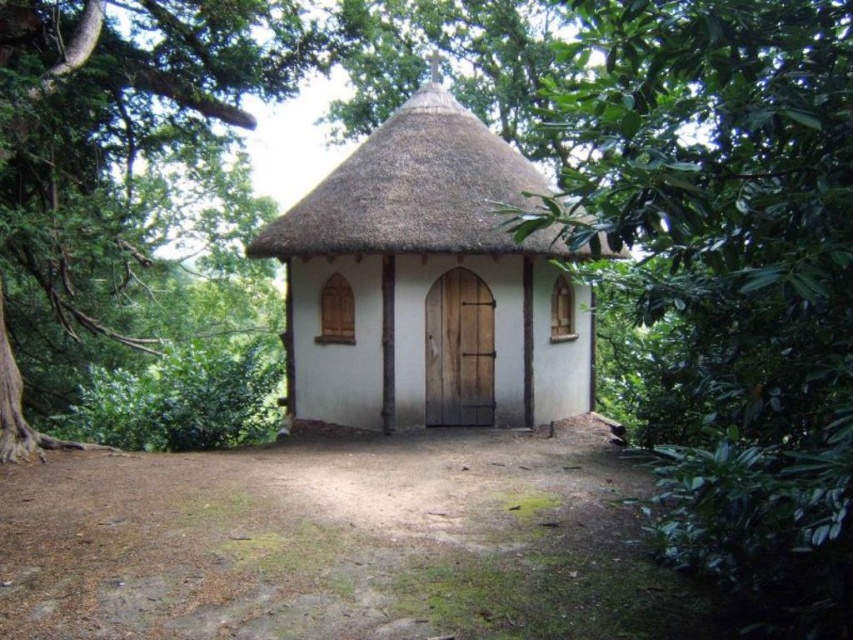
Is green leafy tree at center shorter than white wooden cottage at center?

Indeed, green leafy tree at center has a lesser height compared to white wooden cottage at center.

Does green leafy tree at center have a smaller size compared to white wooden cottage at center?

Yes, green leafy tree at center is smaller than white wooden cottage at center.

Who is more distant from viewer, (704,312) or (448,316)?

Positioned behind is point (448,316).

I want to click on green leafy tree at center, so click(733, 276).

Is white wooden cottage at center to the left of green leafy tree at left from the viewer's perspective?

In fact, white wooden cottage at center is to the right of green leafy tree at left.

Does point (492, 208) come in front of point (86, 198)?

Yes.

The image size is (853, 640). What are the coordinates of `white wooden cottage at center` in the screenshot? It's located at (428, 284).

Can you confirm if green leafy tree at center is thinner than green leafy tree at left?

Yes.

Find the location of a particular element. This screenshot has width=853, height=640. green leafy tree at center is located at coordinates (733, 276).